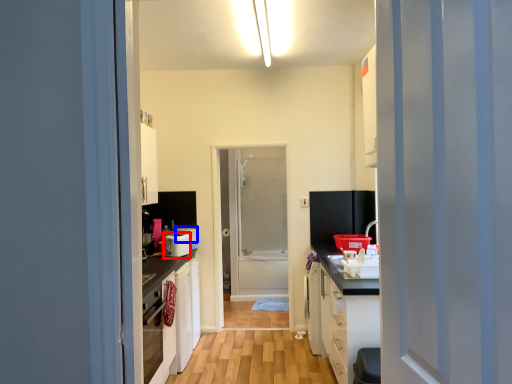
Question: Which point is further to the camera, appliance (highlighted by a red box) or appliance (highlighted by a blue box)?

Choices:
 (A) appliance
 (B) appliance

Answer: (B)